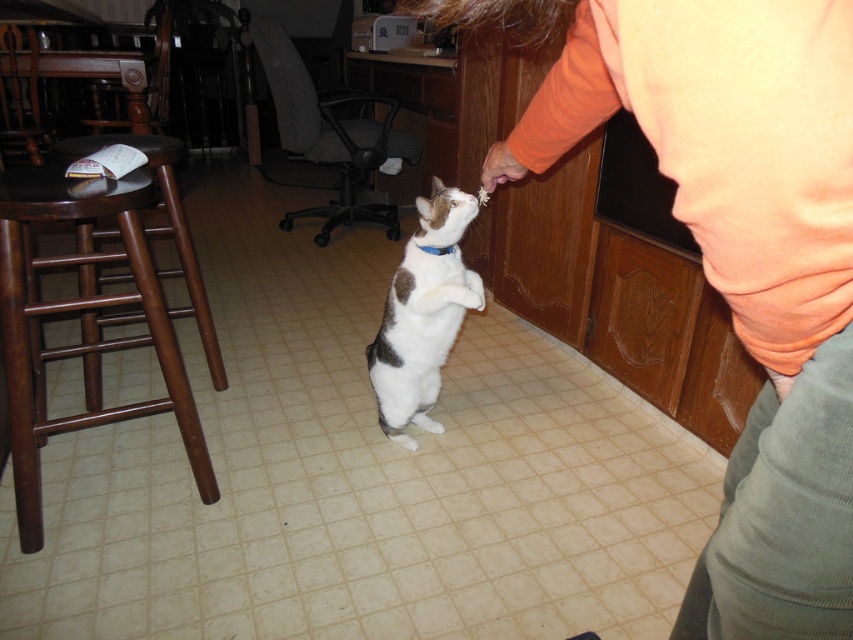
Question: Is orange cotton shirt at upper right above brown wood bar stool at left?

Choices:
 (A) no
 (B) yes

Answer: (B)

Question: Does brown wood bar stool at left come behind blue fabric neckband at center?

Choices:
 (A) no
 (B) yes

Answer: (A)

Question: Which of the following is the farthest from the observer?

Choices:
 (A) brown wood bar stool at left
 (B) orange cotton shirt at upper right
 (C) white fur with brown spots at center

Answer: (C)

Question: Does brown wood bar stool at left come behind white fur with brown spots at center?

Choices:
 (A) no
 (B) yes

Answer: (A)

Question: Which object appears farthest from the camera in this image?

Choices:
 (A) orange cotton shirt at upper right
 (B) brown wood bar stool at left
 (C) blue fabric neckband at center
 (D) white fur with brown spots at center

Answer: (C)

Question: Which object is the closest to the brown wood bar stool at left?

Choices:
 (A) orange cotton shirt at upper right
 (B) blue fabric neckband at center

Answer: (B)